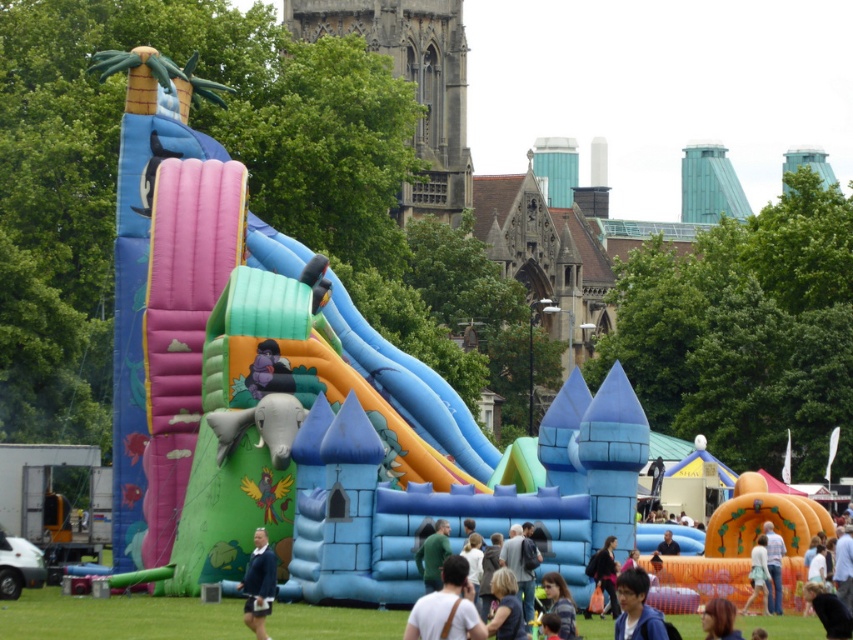
Question: Among these points, which one is nearest to the camera?

Choices:
 (A) (762, 529)
 (B) (432, 564)
 (C) (750, 556)

Answer: (B)

Question: Is green matte shirt at center wider than blonde hair at lower right?

Choices:
 (A) yes
 (B) no

Answer: (B)

Question: Which object is the closest to the blonde hair at center?

Choices:
 (A) dark blue sweater at lower center
 (B) blue denim jacket at lower center

Answer: (B)

Question: Does dark blue sweater at lower center come in front of dark brown hair at center?

Choices:
 (A) no
 (B) yes

Answer: (B)

Question: Which of the following is the closest to the observer?

Choices:
 (A) (666, 550)
 (B) (646, 612)
 (C) (553, 600)
 (D) (708, 628)

Answer: (D)

Question: Is blonde hair at lower right bigger than light brown hair at lower center?

Choices:
 (A) no
 (B) yes

Answer: (B)